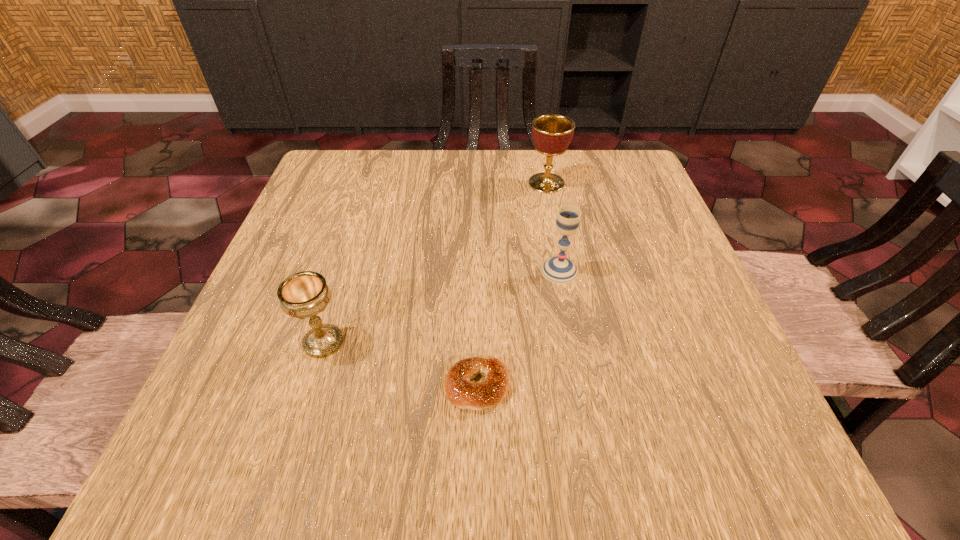
Find the location of a particular element. the farthest chalice is located at coordinates click(552, 133).

Where is `the second nearest chalice`? the second nearest chalice is located at coordinates (560, 270).

This screenshot has height=540, width=960. I want to click on the third farthest object, so click(305, 294).

Locate an element on the screen. The width and height of the screenshot is (960, 540). the leftmost chalice is located at coordinates (305, 294).

Locate an element on the screen. bagel is located at coordinates (464, 394).

You are a GUI agent. You are given a task and a screenshot of the screen. Output one action in this format:
    pyautogui.click(x=<x>, y=<y>)
    Task: Click on the nearest object
    This screenshot has width=960, height=540.
    Given the screenshot: What is the action you would take?
    pyautogui.click(x=464, y=394)

Locate an element on the screen. This screenshot has height=540, width=960. vacant space situated on the left of the farthest chalice is located at coordinates (473, 183).

At what (x,y) coordinates should I click in order to perform the action: click on vacant space located 0.060m on the left of the second farthest chalice. Please return your answer as a coordinate pair (x, y). This screenshot has height=540, width=960. Looking at the image, I should click on (510, 271).

The width and height of the screenshot is (960, 540). Identify the location of free location located on the back of the second nearest object. (370, 192).

The height and width of the screenshot is (540, 960). Find the location of `free point located 0.120m on the right of the shortest object`. free point located 0.120m on the right of the shortest object is located at coordinates (588, 387).